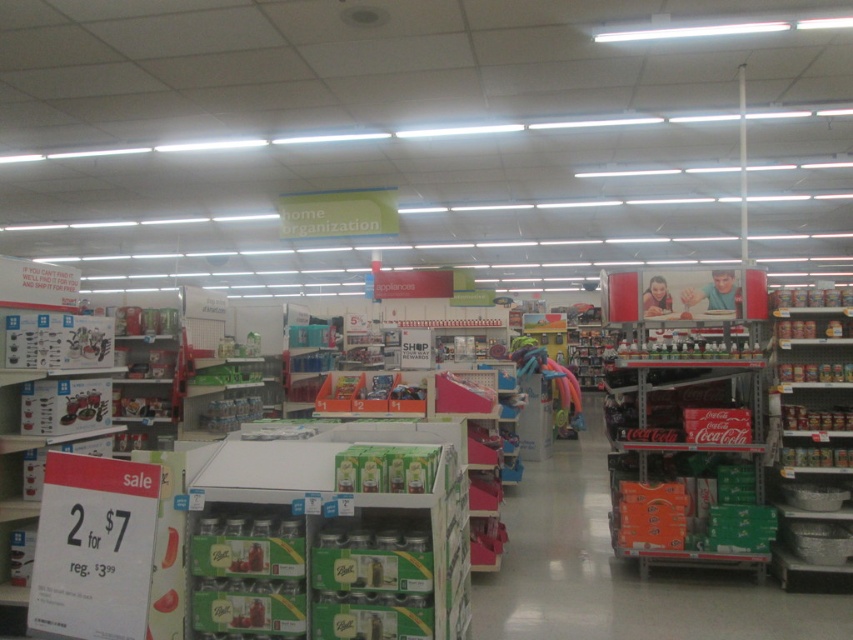
Is green cardboard boxes at center smaller than metallic silver bowls at right?

Indeed, green cardboard boxes at center has a smaller size compared to metallic silver bowls at right.

Is green cardboard boxes at center further to the viewer compared to metallic silver bowls at right?

No, green cardboard boxes at center is closer to the viewer.

Which is in front, point (241, 572) or point (807, 356)?

Point (241, 572) is in front.

This screenshot has width=853, height=640. I want to click on green cardboard boxes at center, so click(x=332, y=534).